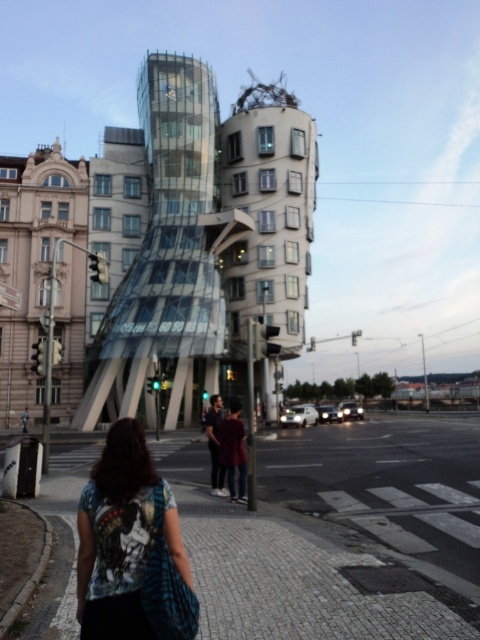
You are standing at the pedestrian crossing in front of the Dancing House. You notice two points marked on the pavement. One is at coordinates point (x=177, y=88) and the other is at point (x=0, y=324). Which point is closer to your current position?

Point (x=177, y=88) is further to the camera than point (x=0, y=324), so the point closer to your current position is point (x=0, y=324).

You are a pedestrian standing on the paved stone at center. Looking up, you see the transparent glass building at center. Can you see the sky through the glass building?

The transparent glass building at center is above the paved stone at center, so yes, you can see the sky through the transparent glass building at center as it is transparent and positioned above you.